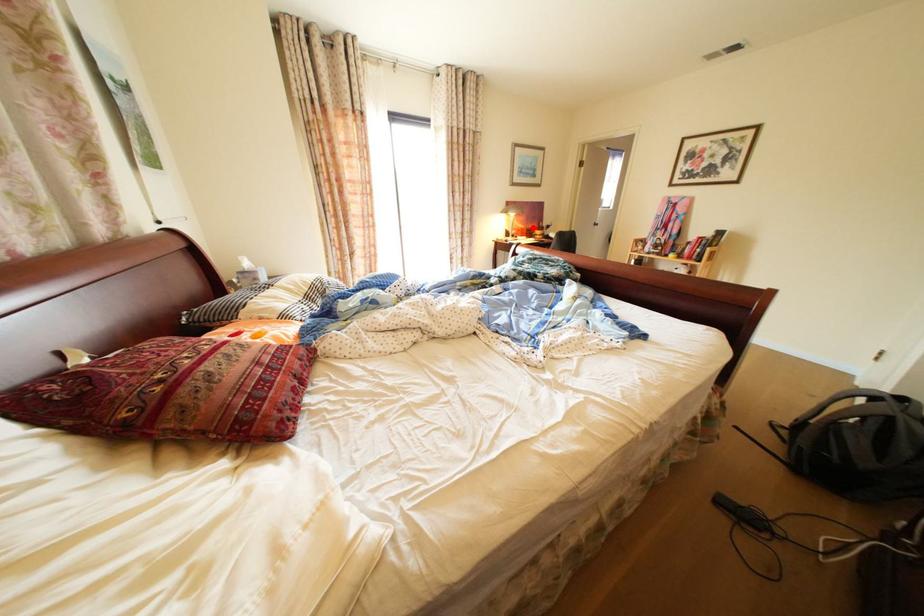
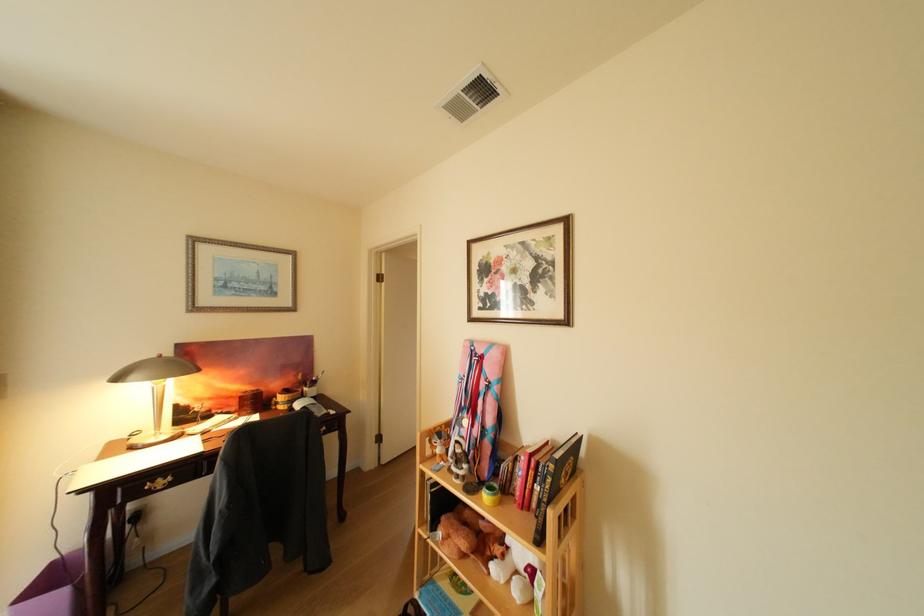
In the second image, find the point that corresponds to the highlighted location in the first image.

(251, 389)